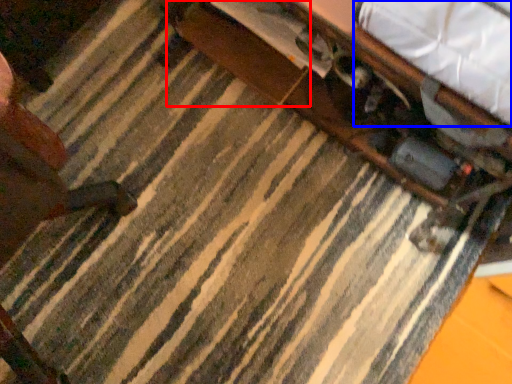
Question: Among these objects, which one is farthest to the camera, drawer (highlighted by a red box) or sheet (highlighted by a blue box)?

Choices:
 (A) drawer
 (B) sheet

Answer: (A)